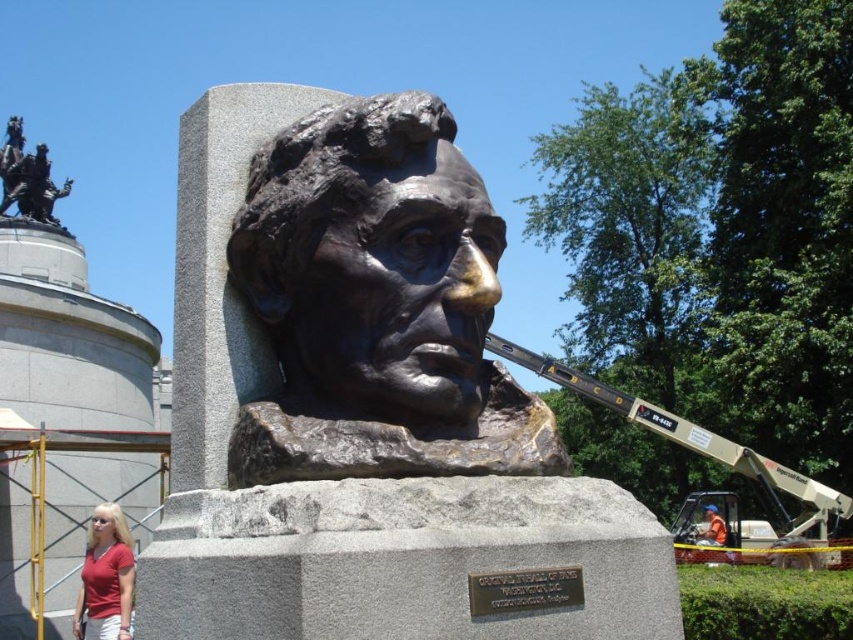
You are standing in front of the bronze bust sculpture and notice two points marked in the image. The first point is at coordinates point (x=125, y=531), and the second is at point (x=718, y=545). Which of these points is nearer to your current position?

Point (x=125, y=531) is closer to the camera than point (x=718, y=545), so the first point is nearer to your current position.

You are standing in a park and see the bronze sculpture at center. If you face the sculpture, which direction should you turn to see the monument visible to the left of the sculpture?

Since the monument is visible to the left of the bronze sculpture at center, you should turn to your left to face the monument.

You are an art student analyzing the composition of the scene. You notice the bronze sculpture at center and the orange fabric at lower right. Which object occupies a larger portion of the image in terms of width?

The orange fabric at lower right has a greater width than the bronze sculpture at center, so it occupies a larger portion of the image in terms of width.